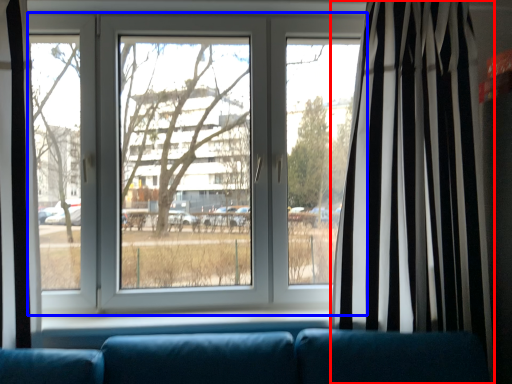
Question: Which of the following is the closest to the observer, curtain (highlighted by a red box) or window (highlighted by a blue box)?

Choices:
 (A) curtain
 (B) window

Answer: (A)